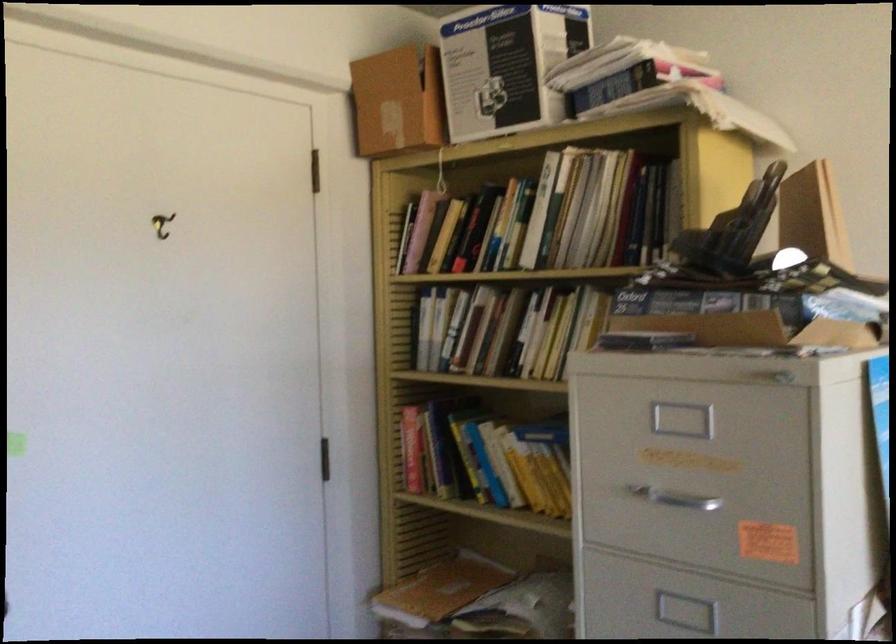
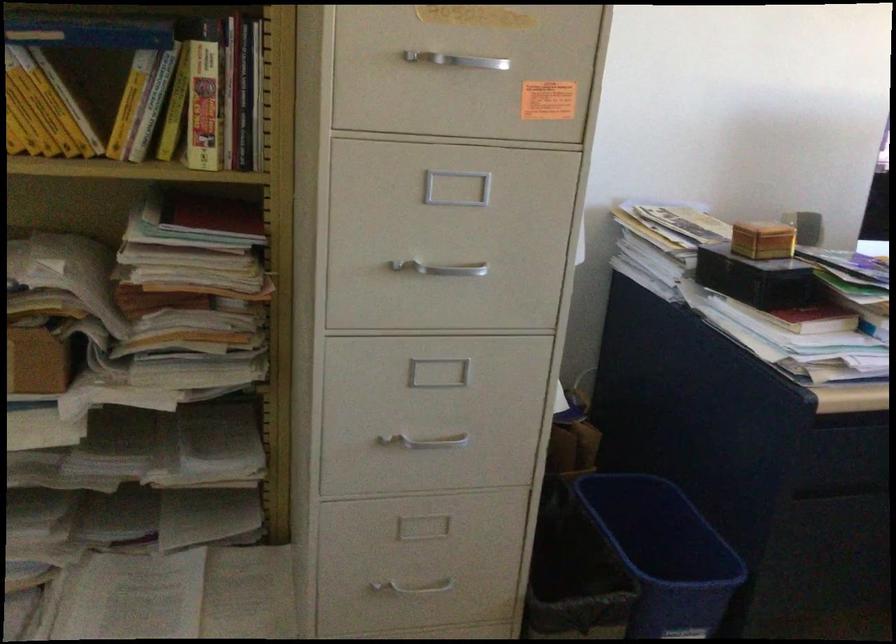
The first image is from the beginning of the video and the second image is from the end. How did the camera likely rotate when shooting the video?

The camera rotated toward right-down.